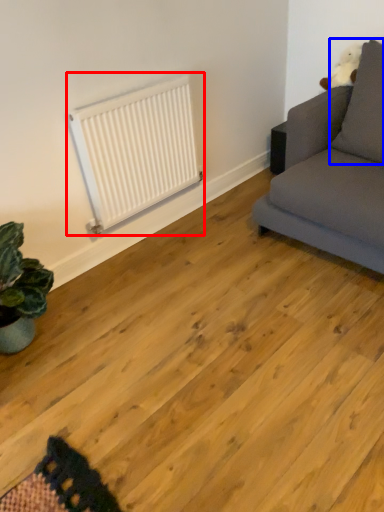
Question: Which of the following is the closest to the observer, radiator (highlighted by a red box) or pillow (highlighted by a blue box)?

Choices:
 (A) radiator
 (B) pillow

Answer: (B)